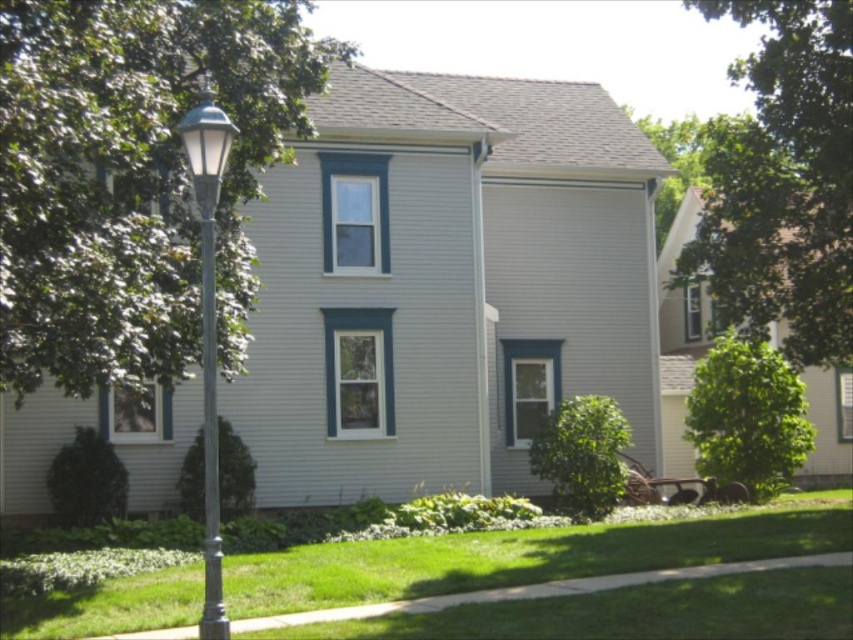
You are standing in front of the house and want to plant a new tree in the yard. The existing green leafy tree at upper right is located at point (782, 180). If you want to plant a new tree exactly 0.3 units to the right of the existing tree, what would be the new coordinate for the new tree?

The existing green leafy tree at upper right is at point (782, 180). To plant a new tree exactly 0.3 units to the right, add 0.3 to the x coordinate. The new coordinate would be 0.584, 0.919.

You are standing in front of the house and want to plant a new tree in your yard. The existing green leafy tree at left is located at coordinates point 0.277, 0.156. If you want to plant a new tree exactly 0.3 units to the right of the existing one, what would be the new coordinates for the new tree?

The new coordinates would be approximately (x=132, y=369) since adding 0.3 to the x coordinate of the existing green leafy tree at left at 0.277 would result in 0.577, while keeping the y coordinate the same.